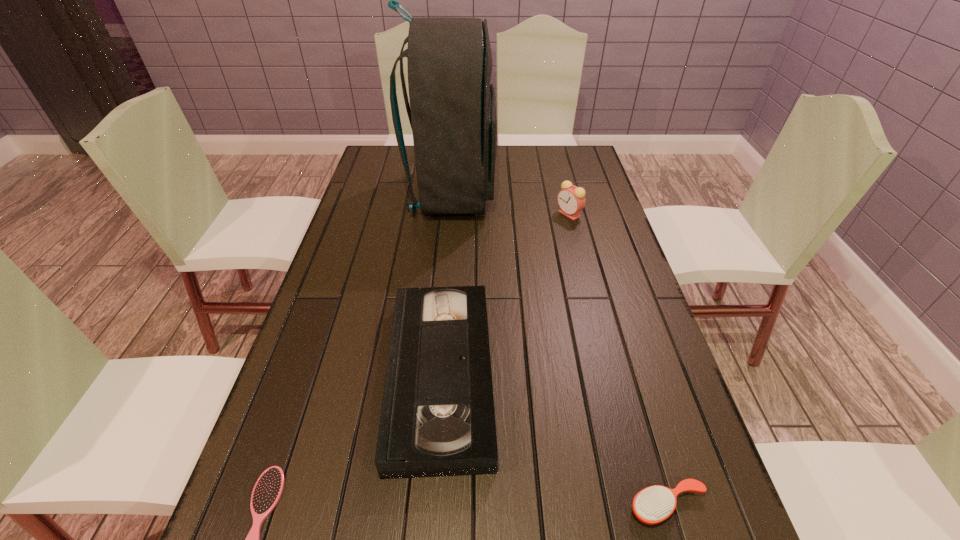
Where is `vacant region located on the left of the right hairbrush`? The width and height of the screenshot is (960, 540). vacant region located on the left of the right hairbrush is located at coordinates (418, 505).

Locate an element on the screen. The height and width of the screenshot is (540, 960). object that is positioned at the far edge is located at coordinates (452, 112).

You are a GUI agent. You are given a task and a screenshot of the screen. Output one action in this format:
    pyautogui.click(x=<x>, y=<y>)
    Task: Click on the alarm clock located in the right edge section of the desktop
    
    Given the screenshot: What is the action you would take?
    pyautogui.click(x=571, y=199)

What are the coordinates of `hairbrush that is positioned at the right edge` in the screenshot? It's located at (654, 504).

In the image, there is a desktop. At what (x,y) coordinates should I click in order to perform the action: click on vacant space at the far edge. Please return your answer as a coordinate pair (x, y). Looking at the image, I should click on (500, 167).

Locate an element on the screen. This screenshot has height=540, width=960. free space at the left edge of the desktop is located at coordinates (350, 271).

At what (x,y) coordinates should I click in order to perform the action: click on free space at the right edge of the desktop. Please return your answer as a coordinate pair (x, y). Looking at the image, I should click on (559, 179).

The image size is (960, 540). Find the location of `free space at the far right corner`. free space at the far right corner is located at coordinates (565, 170).

At what (x,y) coordinates should I click in order to perform the action: click on free spot between the fourth tallest object and the alarm clock. Please return your answer as a coordinate pair (x, y). This screenshot has height=540, width=960. Looking at the image, I should click on (618, 360).

Identify the location of vacant area that lies between the tallest object and the second tallest object. (511, 204).